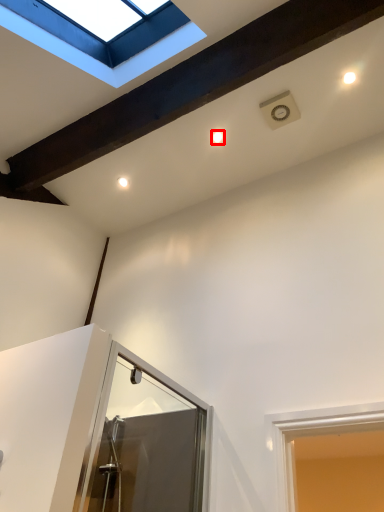
Question: Where is droplight (annotated by the red box) located in relation to window in the image?

Choices:
 (A) right
 (B) left

Answer: (A)